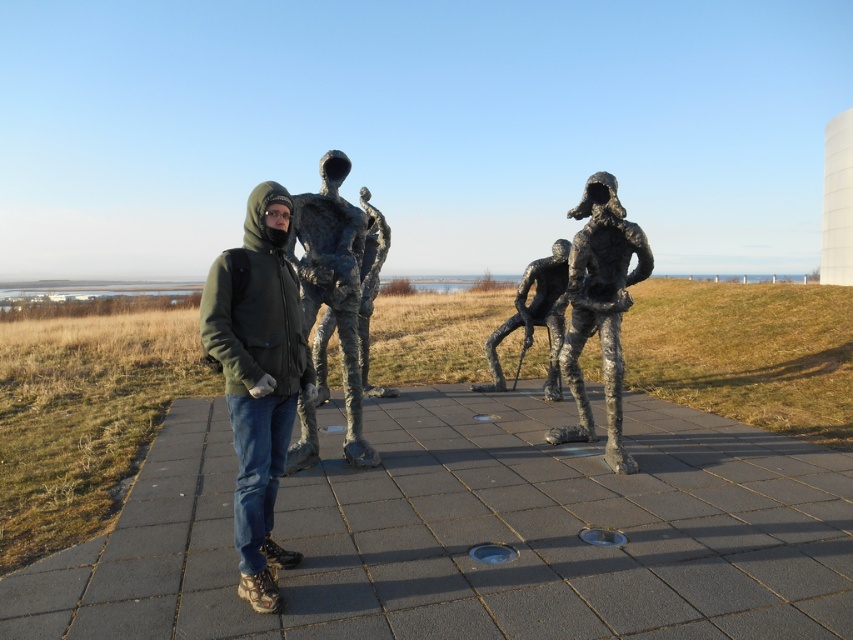
Can you confirm if bronze textured figure at center is thinner than shiny bronze statue at center?

In fact, bronze textured figure at center might be wider than shiny bronze statue at center.

From the picture: Which is more to the left, bronze textured figure at center or shiny bronze statue at center?

shiny bronze statue at center is more to the left.

Is point (612, 304) positioned before point (345, 368)?

No, (612, 304) is further to viewer.

Identify the location of bronze textured figure at center. The image size is (853, 640). (601, 308).

Can you confirm if shiny bronze statue at center is wider than polished bronze figure at center?

In fact, shiny bronze statue at center might be narrower than polished bronze figure at center.

Is point (344, 237) more distant than point (553, 332)?

No, it is in front of (553, 332).

Identify the location of shiny bronze statue at center. This screenshot has width=853, height=640. (334, 282).

Between point (757, 474) and point (616, 456), which one is positioned in front?

Point (757, 474) is in front.

Between point (554, 481) and point (584, 259), which one is positioned in front?

Point (554, 481) is more forward.

This screenshot has height=640, width=853. I want to click on gray concrete pavement at center, so click(471, 532).